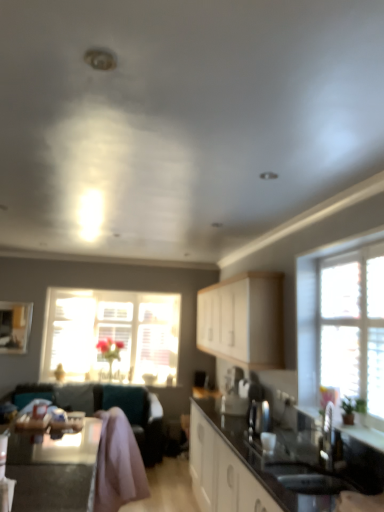
Question: Is black glossy sink at lower right surrounded by black glossy table at lower left?

Choices:
 (A) yes
 (B) no

Answer: (B)

Question: Can you confirm if black glossy table at lower left is positioned to the left of black glossy sink at lower right?

Choices:
 (A) yes
 (B) no

Answer: (A)

Question: Is black glossy table at lower left in front of black glossy sink at lower right?

Choices:
 (A) yes
 (B) no

Answer: (A)

Question: From a real-world perspective, is black glossy table at lower left physically above black glossy sink at lower right?

Choices:
 (A) yes
 (B) no

Answer: (B)

Question: Is black glossy table at lower left outside black glossy sink at lower right?

Choices:
 (A) no
 (B) yes

Answer: (B)

Question: Does black glossy table at lower left have a lesser height compared to black glossy sink at lower right?

Choices:
 (A) no
 (B) yes

Answer: (A)

Question: Is white matte cabinet at center looking in the opposite direction of translucent glass window at center, which is the first window in left-to-right order?

Choices:
 (A) yes
 (B) no

Answer: (B)

Question: Considering the relative sizes of white matte cabinet at center and translucent glass window at center, marked as the second window in a right-to-left arrangement, in the image provided, is white matte cabinet at center shorter than translucent glass window at center, marked as the second window in a right-to-left arrangement,?

Choices:
 (A) yes
 (B) no

Answer: (A)

Question: Can we say white matte cabinet at center lies outside translucent glass window at center, which is the first window in left-to-right order?

Choices:
 (A) yes
 (B) no

Answer: (A)

Question: From the image's perspective, does white matte cabinet at center appear lower than translucent glass window at center, marked as the second window in a right-to-left arrangement?

Choices:
 (A) yes
 (B) no

Answer: (B)

Question: From the image's perspective, is white matte cabinet at center on top of translucent glass window at center, which is the first window in left-to-right order?

Choices:
 (A) yes
 (B) no

Answer: (A)

Question: Is white matte cabinet at center not near translucent glass window at center, which is the first window in left-to-right order?

Choices:
 (A) no
 (B) yes

Answer: (B)

Question: Is teal fabric couch at lower left not near satin silver kettle at center?

Choices:
 (A) no
 (B) yes

Answer: (B)